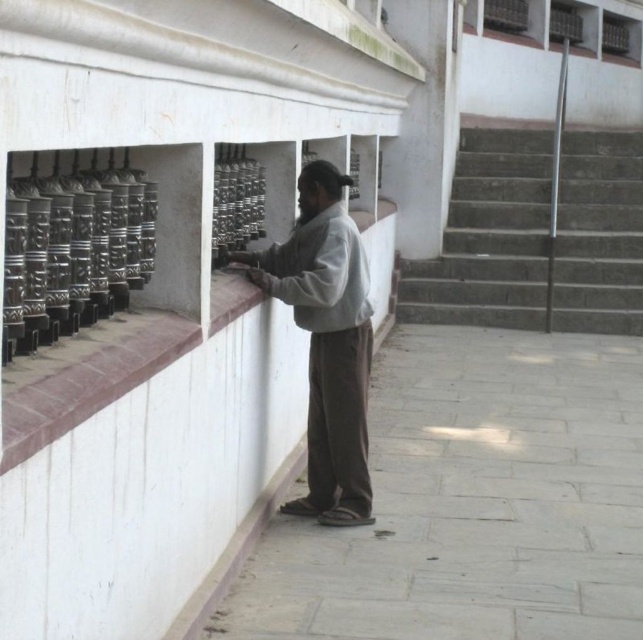
Question: Is concrete stairs at right closer to camera compared to gray cotton shirt at center?

Choices:
 (A) yes
 (B) no

Answer: (B)

Question: Can you confirm if concrete stairs at right is positioned to the right of gray cotton shirt at center?

Choices:
 (A) yes
 (B) no

Answer: (A)

Question: Among these points, which one is nearest to the camera?

Choices:
 (A) (323, 301)
 (B) (471, 212)

Answer: (A)

Question: Can you confirm if concrete stairs at right is smaller than gray cotton shirt at center?

Choices:
 (A) no
 (B) yes

Answer: (A)